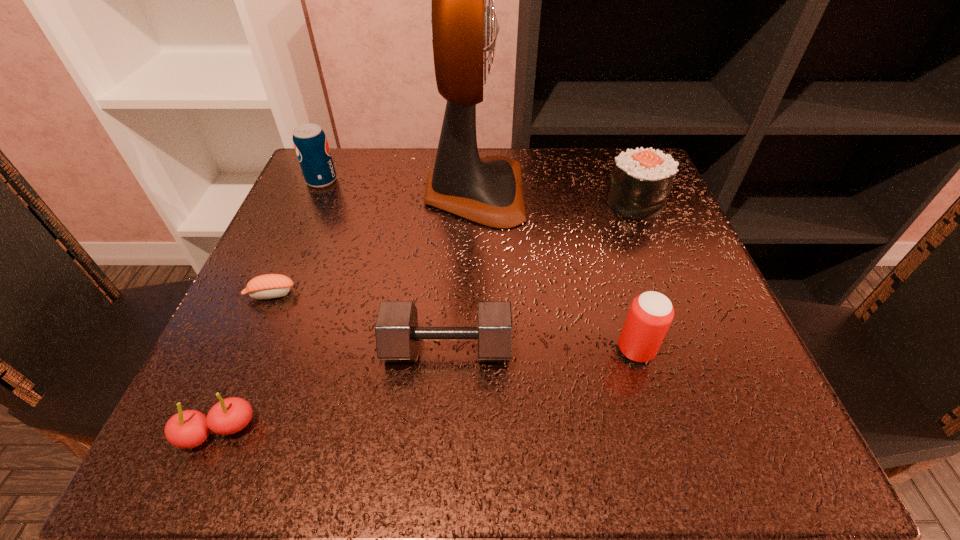
Where is `pop situated at the left edge`? The image size is (960, 540). pop situated at the left edge is located at coordinates (310, 142).

Where is `cherry that is at the left edge`? Image resolution: width=960 pixels, height=540 pixels. cherry that is at the left edge is located at coordinates (187, 429).

Identify the location of sushi present at the left edge. (268, 286).

Identify the location of sushi positioned at the right edge. The height and width of the screenshot is (540, 960). (641, 179).

You are a GUI agent. You are given a task and a screenshot of the screen. Output one action in this format:
    pyautogui.click(x=<x>, y=<y>)
    Task: Click on the beer can that is at the right edge
    
    Given the screenshot: What is the action you would take?
    pos(651,313)

Where is `object that is at the far left corner`? object that is at the far left corner is located at coordinates (310, 142).

You are a GUI agent. You are given a task and a screenshot of the screen. Output one action in this format:
    pyautogui.click(x=<x>, y=<y>)
    Task: Click on the object present at the near left corner
    This screenshot has width=960, height=540.
    Given the screenshot: What is the action you would take?
    pyautogui.click(x=187, y=429)

Locate an element on the screen. Image resolution: width=960 pixels, height=540 pixels. object that is at the far right corner is located at coordinates (641, 179).

In the image, there is a desktop. Identify the location of vacant space at the far edge. The width and height of the screenshot is (960, 540). (396, 204).

Identify the location of vacant area at the near edge. The image size is (960, 540). (603, 456).